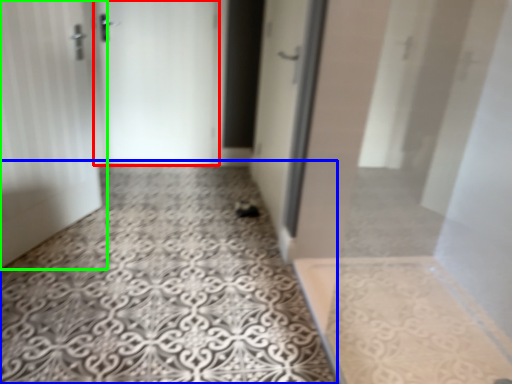
Question: Which object is positioned closest to door (highlighted by a red box)? Select from concrete (highlighted by a blue box) and door (highlighted by a green box).

Choices:
 (A) concrete
 (B) door

Answer: (B)